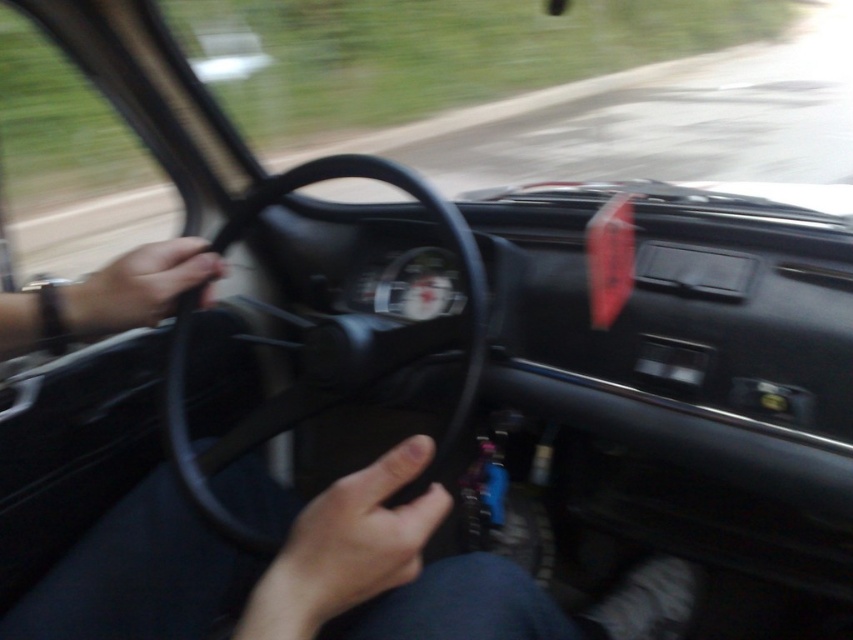
Does black rubber steering wheel at center appear on the left side of skinny flesh at center?

Indeed, black rubber steering wheel at center is positioned on the left side of skinny flesh at center.

Who is positioned more to the left, black rubber steering wheel at center or skinny flesh at center?

From the viewer's perspective, black rubber steering wheel at center appears more on the left side.

This screenshot has height=640, width=853. Describe the element at coordinates (328, 349) in the screenshot. I see `black rubber steering wheel at center` at that location.

Locate an element on the screen. black rubber steering wheel at center is located at coordinates (328, 349).

Can you confirm if skinny flesh at center is positioned below matte black steering wheel at left?

Indeed, skinny flesh at center is positioned under matte black steering wheel at left.

From the picture: Is skinny flesh at center wider than matte black steering wheel at left?

In fact, skinny flesh at center might be narrower than matte black steering wheel at left.

Who is more distant from viewer, (338, 612) or (175, 273)?

Positioned behind is point (175, 273).

This screenshot has height=640, width=853. What are the coordinates of `skinny flesh at center` in the screenshot? It's located at (347, 547).

Is point (467, 285) closer to camera compared to point (173, 275)?

Yes, it is.

Locate an element on the screen. black rubber steering wheel at center is located at coordinates (328, 349).

Locate an element on the screen. black rubber steering wheel at center is located at coordinates (328, 349).